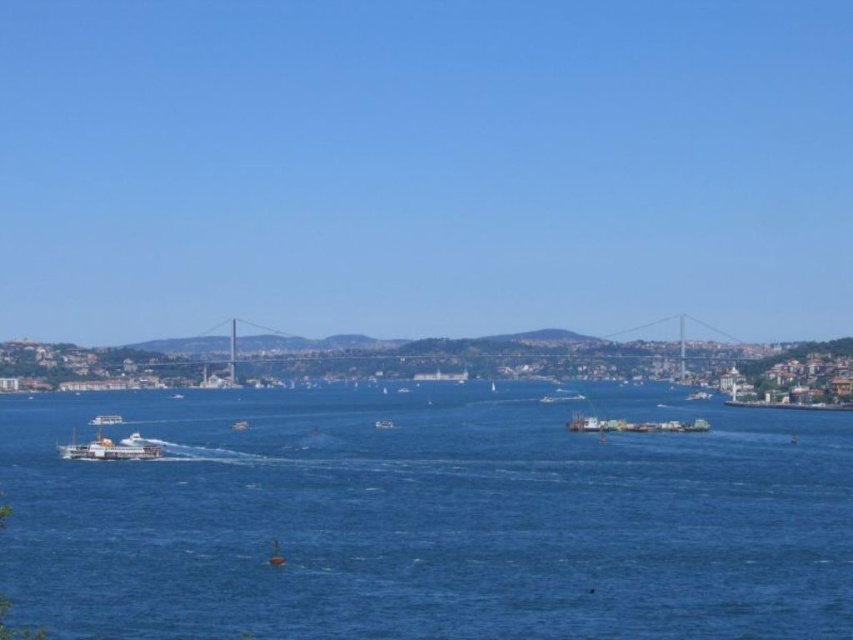
Between point (80, 451) and point (277, 541), which one is positioned behind?

Point (80, 451)

What do you see at coordinates (109, 449) in the screenshot?
I see `white matte ferry at lower left` at bounding box center [109, 449].

Locate an element on the screen. This screenshot has height=640, width=853. white matte ferry at lower left is located at coordinates (109, 449).

Is point (430, 621) positioned after point (280, 563)?

No, it is not.

Which is in front, point (393, 458) or point (279, 554)?

Point (279, 554)

Between point (791, 468) and point (274, 545), which one is positioned behind?

The point (791, 468) is more distant.

Image resolution: width=853 pixels, height=640 pixels. I want to click on blue water at center, so coord(427,518).

Between white matte ferry at lower left and white plastic boat at center, which one has more height?

Standing taller between the two is white matte ferry at lower left.

Does white matte ferry at lower left appear under white plastic boat at center?

Actually, white matte ferry at lower left is above white plastic boat at center.

Where is `white matte ferry at lower left`? white matte ferry at lower left is located at coordinates (109, 449).